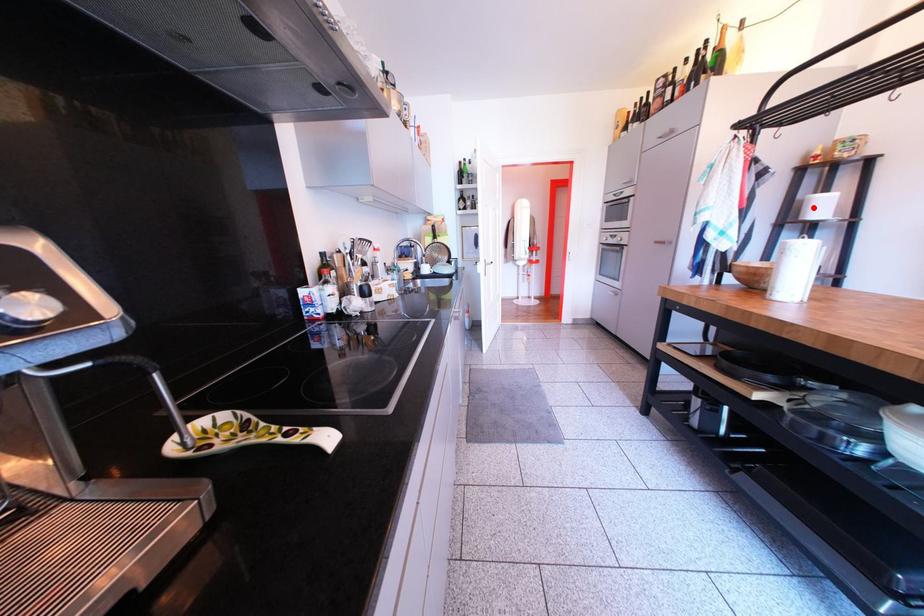
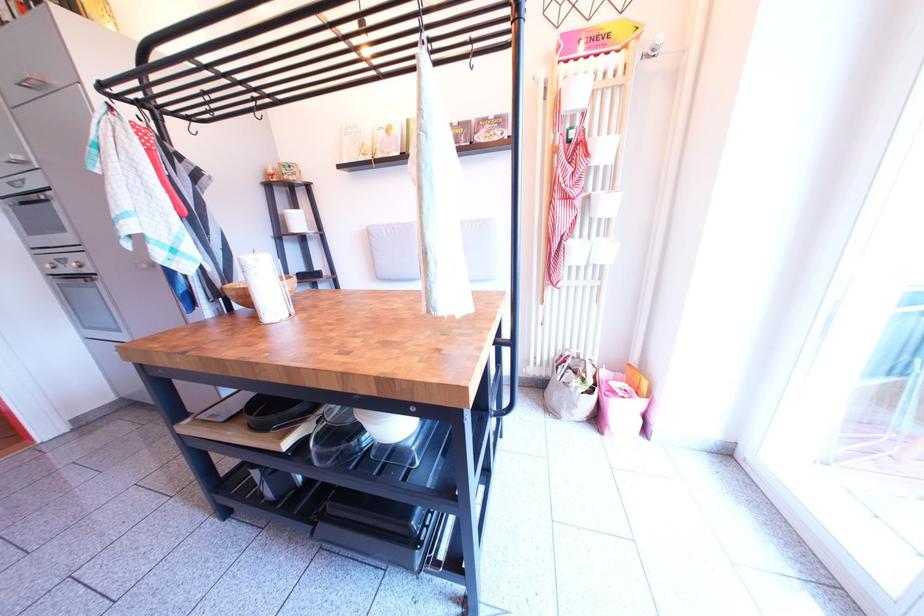
Where in the second image is the point corresponding to the highlighted location from the first image?

(295, 222)